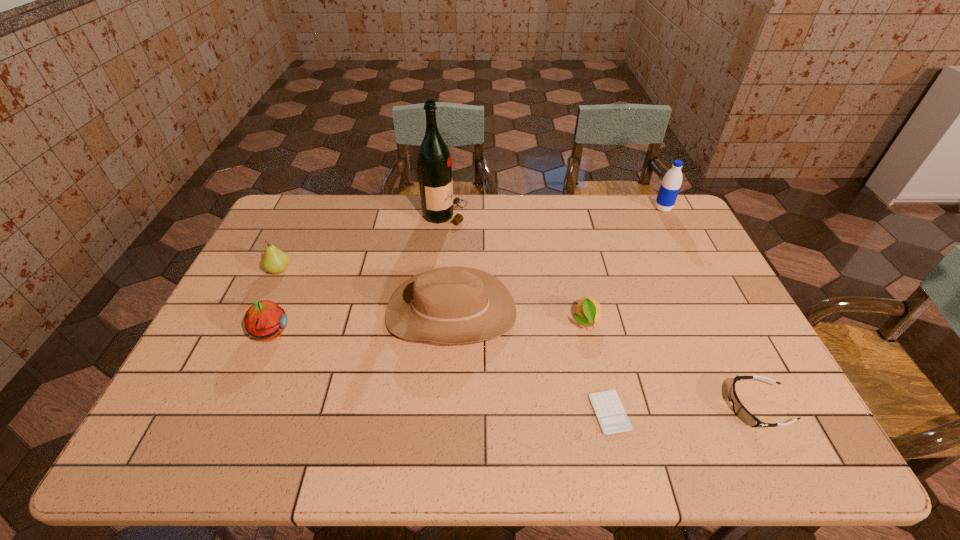
You are a GUI agent. You are given a task and a screenshot of the screen. Output one action in this format:
    pyautogui.click(x=<x>, y=<y>)
    Task: Click on the blank space located on the back of the cowboy hat
    This screenshot has width=960, height=540.
    Given the screenshot: What is the action you would take?
    pyautogui.click(x=454, y=261)

Where is `free location located 0.220m on the right of the pear`? This screenshot has width=960, height=540. free location located 0.220m on the right of the pear is located at coordinates (362, 270).

Find the location of a particular element. This screenshot has height=540, width=960. free location located 0.080m on the right of the apple is located at coordinates (319, 334).

What are the coordinates of `vacant space located with leaves positioned above the lemon` in the screenshot? It's located at (593, 354).

Find the location of a particular element. free space located on the front and sides of the second shortest object is located at coordinates (573, 407).

The width and height of the screenshot is (960, 540). In order to click on vacant space located on the front and sides of the second shortest object in this screenshot , I will do `click(690, 407)`.

Identify the location of free space located 0.110m on the front and sides of the second shortest object. The height and width of the screenshot is (540, 960). (682, 407).

Locate an element on the screen. Image resolution: width=960 pixels, height=540 pixels. vacant region located 0.070m on the right of the shortest object is located at coordinates (657, 413).

The height and width of the screenshot is (540, 960). I want to click on wine bottle present at the far edge, so click(434, 164).

This screenshot has height=540, width=960. I want to click on water bottle that is at the far edge, so click(x=670, y=186).